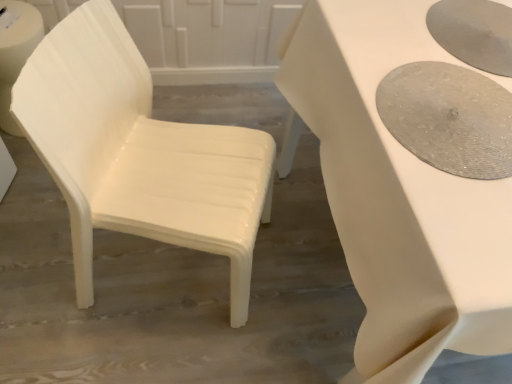
At what (x,y) coordinates should I click in order to perform the action: click on vacant area on top of matte silver tray at right (from a real-world perspective). Please return your answer as a coordinate pair (x, y). Looking at the image, I should click on (453, 106).